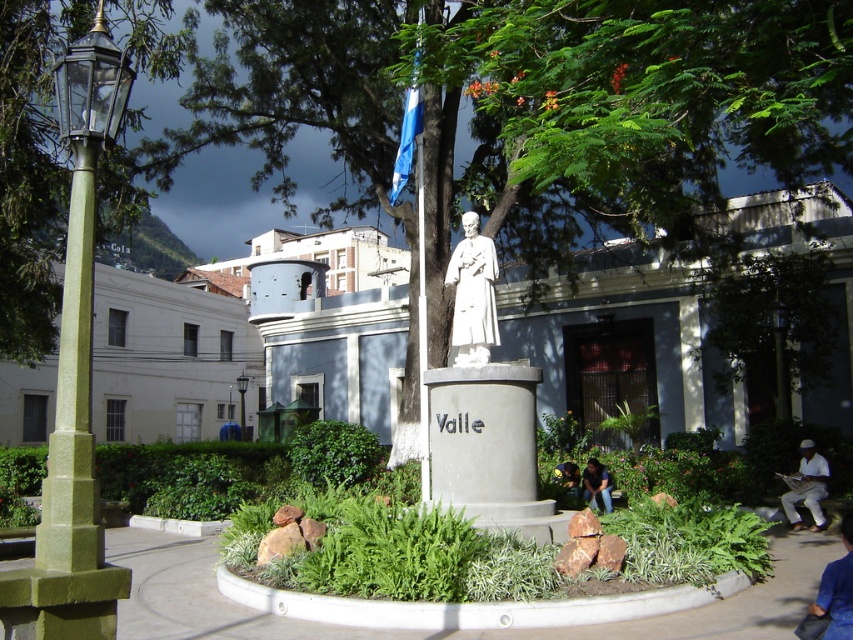
Question: Does green leafy tree at left appear on the right side of green painted metal streetlamp at center-left?

Choices:
 (A) no
 (B) yes

Answer: (A)

Question: Among these points, which one is nearest to the camera?

Choices:
 (A) (821, 602)
 (B) (68, 509)
 (C) (526, 438)
 (D) (799, 460)

Answer: (B)

Question: Is jeans at center below green painted metal streetlamp at center-left?

Choices:
 (A) no
 (B) yes

Answer: (B)

Question: Which object is closer to the camera taking this photo?

Choices:
 (A) green fabric bag at lower center
 (B) white marble statue at center
 (C) blue fabric pants at lower right

Answer: (C)

Question: Which of the following is the farthest from the observer?

Choices:
 (A) (834, 600)
 (B) (467, 260)
 (C) (799, 477)
 (D) (595, 506)

Answer: (D)

Question: Can you confirm if blue fabric pants at lower right is wider than green painted metal streetlamp at center-left?

Choices:
 (A) no
 (B) yes

Answer: (B)